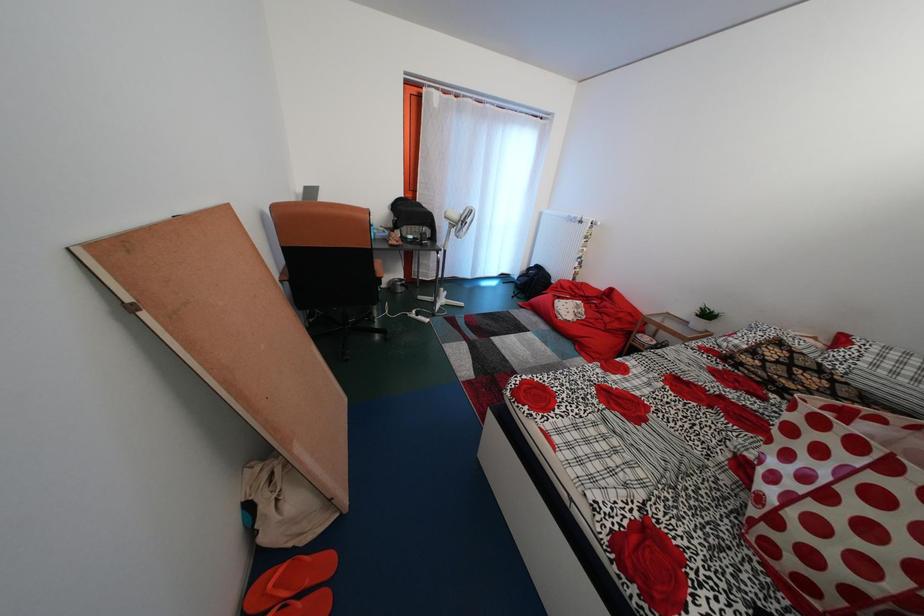
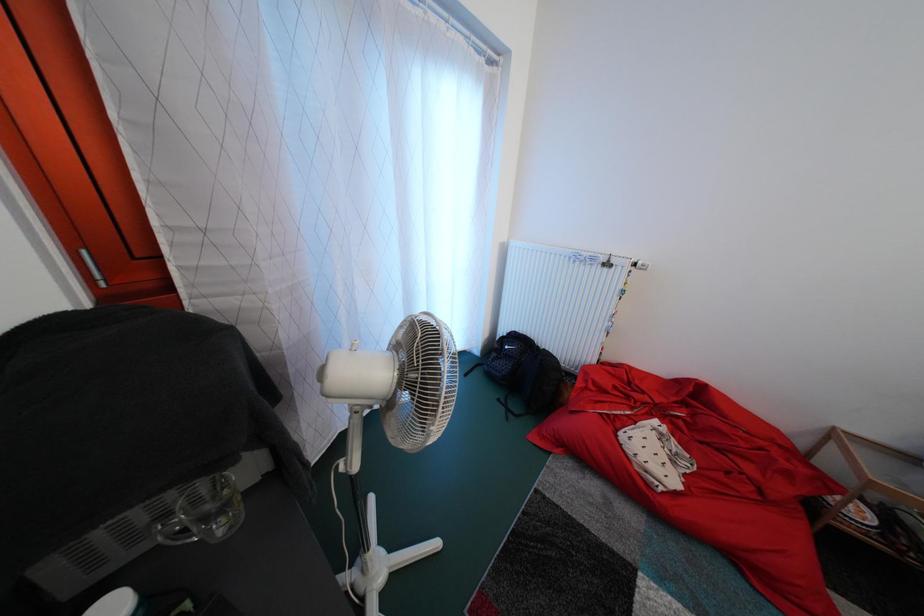
Question: What movement of the cameraman would produce the second image?

Choices:
 (A) Left
 (B) Right
 (C) Forward
 (D) Backward

Answer: (C)